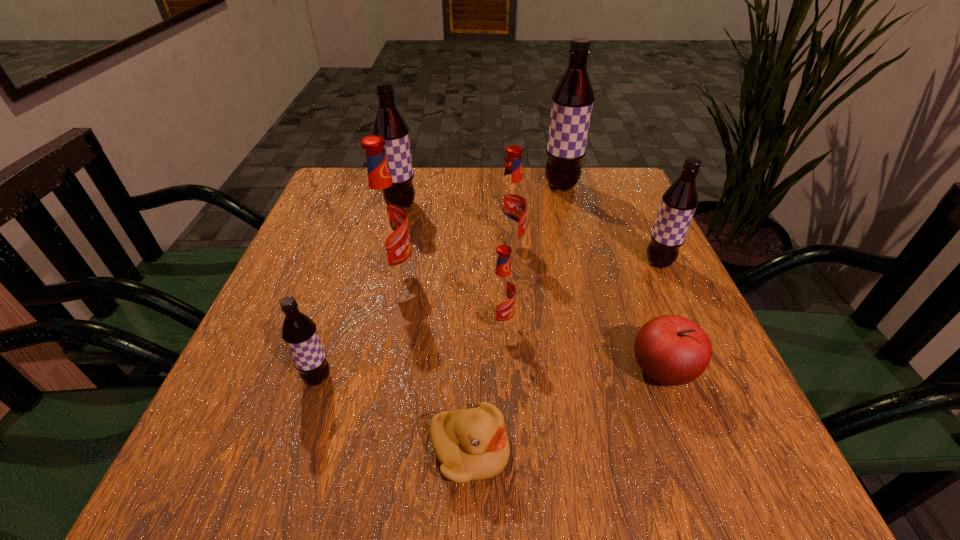
The image size is (960, 540). What are the coordinates of `brown root beer that is the closest to the leftmost brown root beer` in the screenshot? It's located at (389, 123).

Identify the location of the second closest red root beer relative to the third brown root beer from left to right. This screenshot has width=960, height=540. (385, 220).

The height and width of the screenshot is (540, 960). In order to click on red root beer that is the closest to the leftmost object in this screenshot , I will do `click(385, 220)`.

In order to click on vacant space that satisfies the following two spatial constraints: 1. on the back side of the third biggest brown root beer; 2. on the right side of the nearest root beer in this screenshot , I will do `click(355, 262)`.

Image resolution: width=960 pixels, height=540 pixels. Find the location of `blank space that satisfies the following two spatial constraints: 1. on the front side of the biggest red root beer; 2. on the right side of the eighth nearest object`. blank space that satisfies the following two spatial constraints: 1. on the front side of the biggest red root beer; 2. on the right side of the eighth nearest object is located at coordinates (384, 275).

At what (x,y) coordinates should I click in order to perform the action: click on vacant point that satisfies the following two spatial constraints: 1. on the front side of the farthest red root beer; 2. on the right side of the second smallest brown root beer. Please return your answer as a coordinate pair (x, y). Looking at the image, I should click on (511, 262).

Locate an element on the screen. The width and height of the screenshot is (960, 540). vacant position in the image that satisfies the following two spatial constraints: 1. on the front side of the second farthest object; 2. on the left side of the sixth farthest object is located at coordinates (372, 325).